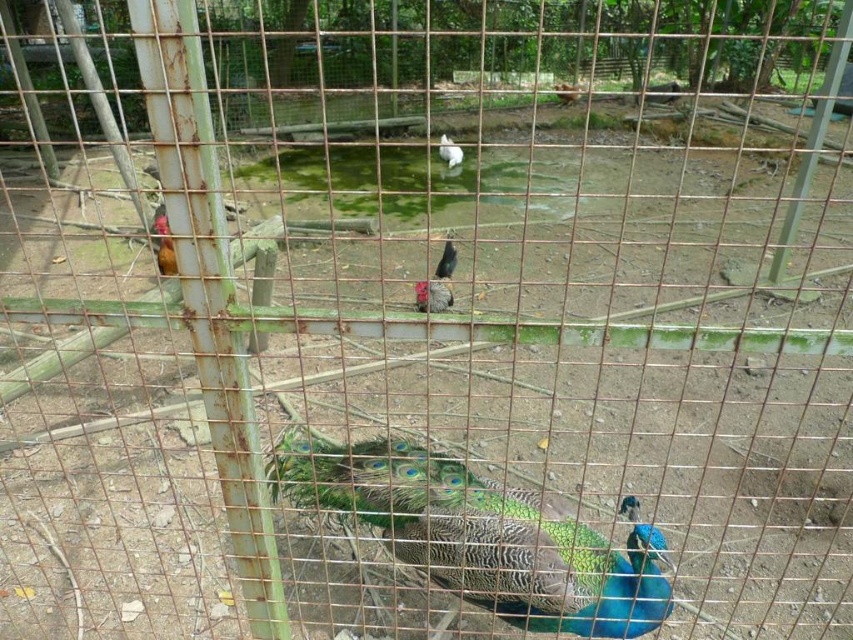
From the picture: You are a zookeeper who needs to feed the animals. You have a bag of feed that you want to place on the smooth brown wooden stick at upper center. However, you are standing next to the white feathered chicken at center. Can you safely place the feed on the stick without getting too close to the chicken?

The white feathered chicken at center is 2.82 meters away from the smooth brown wooden stick at upper center. Since the distance is relatively large, you can safely place the feed on the stick without getting too close to the chicken.

Based on the photo, you are a zookeeper who wants to locate the white feathered chicken at center in the enclosure. According to the coordinates provided, where should you look relative to the peacock?

The white feathered chicken at center is located at coordinates point (450, 150), which is to the left of the peacock.